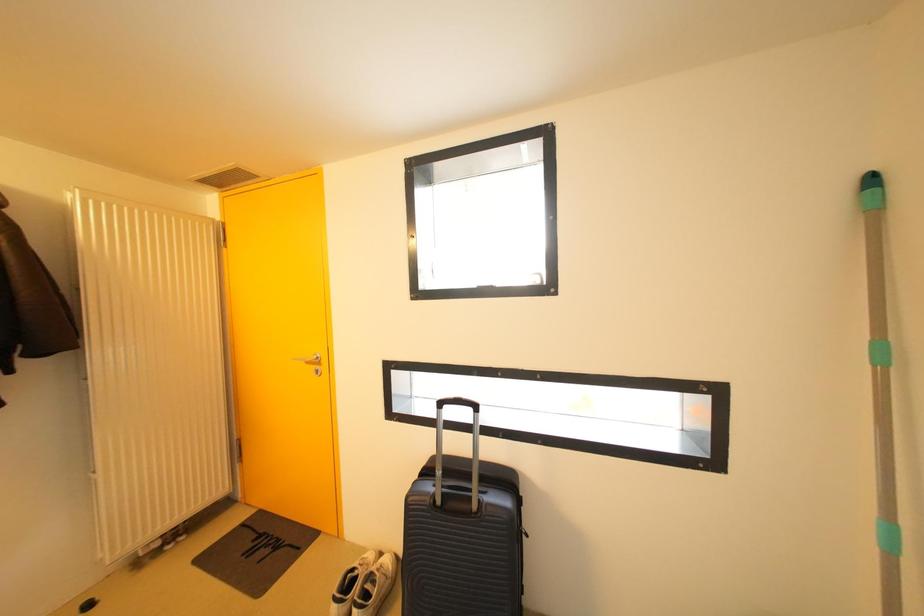
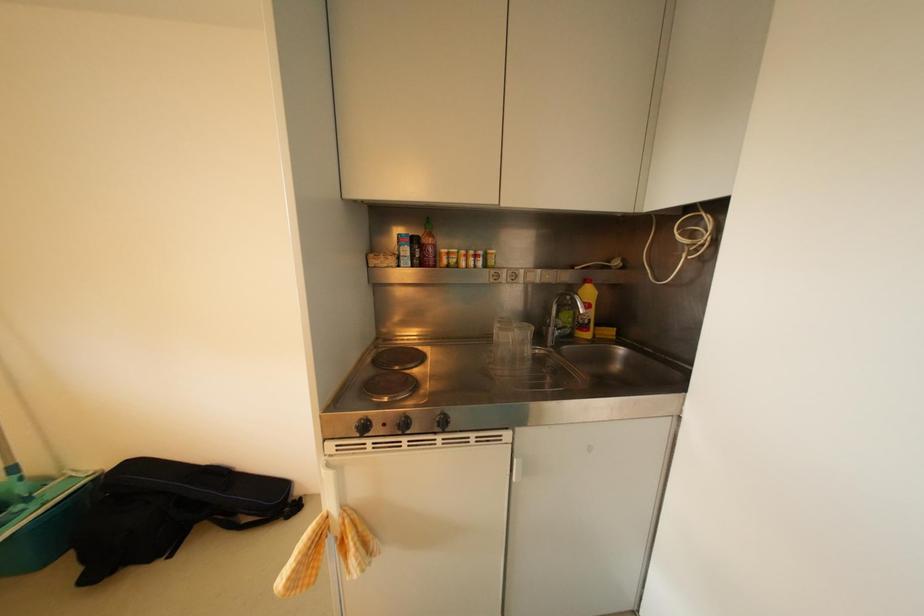
Question: The first image is from the beginning of the video and the second image is from the end. How did the camera likely rotate when shooting the video?

Choices:
 (A) Left
 (B) Right
 (C) Up
 (D) Down

Answer: (B)